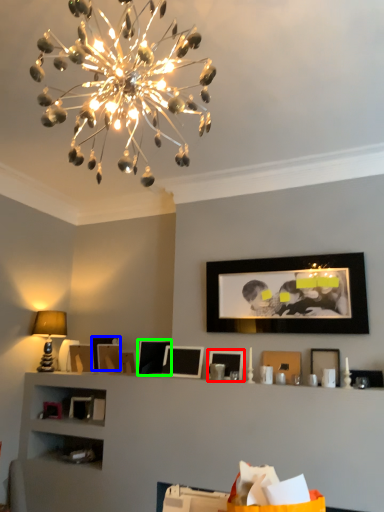
Question: Based on their relative distances, which object is farther from picture frame (highlighted by a red box)? Choose from picture frame (highlighted by a blue box) and picture frame (highlighted by a green box).

Choices:
 (A) picture frame
 (B) picture frame

Answer: (A)